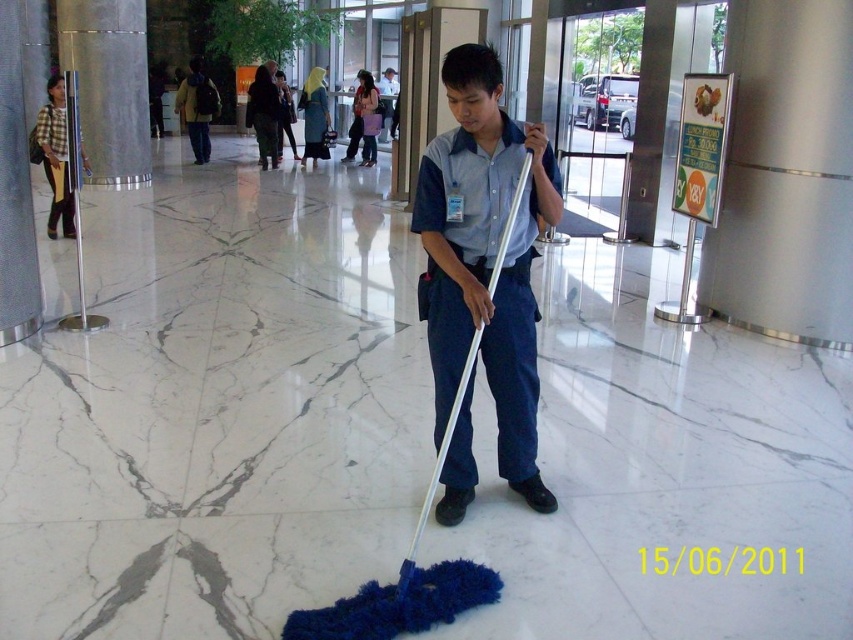
You are standing at the entrance of the building and see two people in the scene, one wearing a plaid fabric shirt at left and the other in a light blue shirt at center. Which person is closer to you?

The plaid fabric shirt at left is closer to the viewer than the light blue shirt at center, so the person in the plaid fabric shirt at left is closer.

You are a guest at this building and want to determine if the blue fabric mop at center can be placed upright against the wall without touching the light blue shirt at center. Based on their heights, is this possible?

The blue fabric mop at center is not as tall as the light blue shirt at center, so placing it upright would mean the mop is shorter than the shirt. Since the shirt is part of the person wearing it, the distance between the mop and the shirt would depend on their positions. However, based on height alone, the mop is shorter and might not reach the same height as the shirt, so it might not touch if positioned appropriately.

You are standing in the lobby and want to take a photo of the two points marked in the image. Which point, point [531,304] or point [206,145], will appear larger in your camera view?

Point [531,304] will appear larger in the camera view because it is closer to the camera than point [206,145].